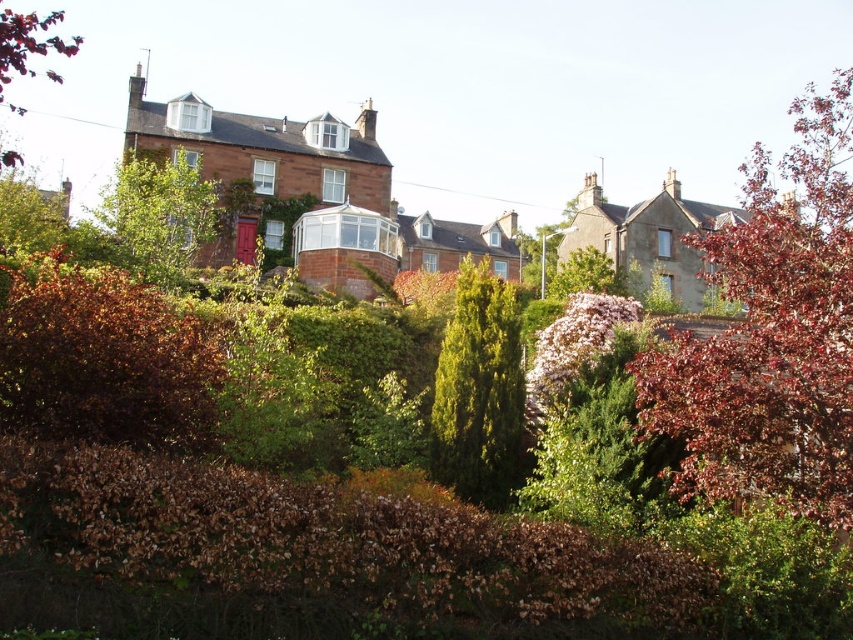
You are standing in the residential area and want to take a photo of the green leafy tree at center without the dark red leafy tree at upper right blocking it. How should you position yourself to achieve this?

Move to a position where the dark red leafy tree at upper right is behind you relative to the green leafy tree at center. Since the dark red leafy tree at upper right is in front of the green leafy tree at center, positioning yourself so that the dark red tree is behind you will allow you to capture the green tree without obstruction.

Looking at this image, you are standing in the residential area shown in the image. If you want to locate the dark red leafy tree at upper right, where should you look relative to the central house?

The dark red leafy tree at upper right is located at coordinates approximately 0.523 along the horizontal axis and 0.906 along the vertical axis relative to the central house.

From the picture: You are standing in the residential area and want to take a photo of the dark red leafy tree at upper right. Based on its position in the image, where should you aim your camera?

The dark red leafy tree at upper right is located at point (x=772, y=333), so you should aim your camera towards the upper right area of the scene to capture it.